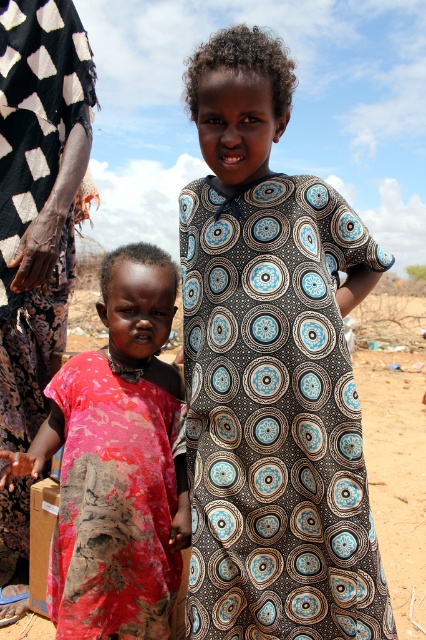
Question: Where is black printed dress at center located in relation to rusty fabric dress at center in the image?

Choices:
 (A) right
 (B) left

Answer: (A)

Question: Which of the following is the closest to the observer?

Choices:
 (A) rusty fabric dress at center
 (B) black printed dress at left
 (C) black printed dress at center

Answer: (C)

Question: Is rusty fabric dress at center further to the viewer compared to black printed dress at left?

Choices:
 (A) no
 (B) yes

Answer: (A)

Question: Considering the relative positions of black printed dress at center and rusty fabric dress at center in the image provided, where is black printed dress at center located with respect to rusty fabric dress at center?

Choices:
 (A) above
 (B) below

Answer: (A)

Question: Which is farther from the black printed dress at center?

Choices:
 (A) rusty fabric dress at center
 (B) black printed dress at left

Answer: (B)

Question: Which of the following is the farthest from the observer?

Choices:
 (A) black printed dress at center
 (B) rusty fabric dress at center

Answer: (B)